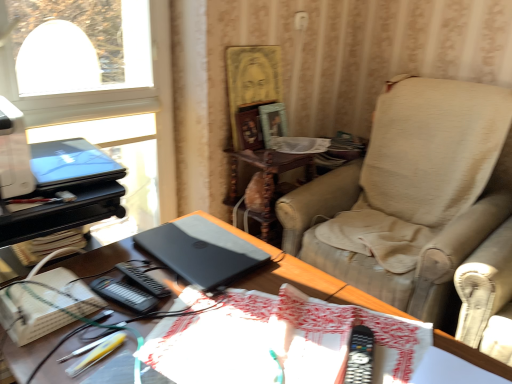
Locate an element on the screen. This screenshot has width=512, height=384. free space to the left of matte black laptop at center, which is counted as the first laptop, starting from the right is located at coordinates (115, 262).